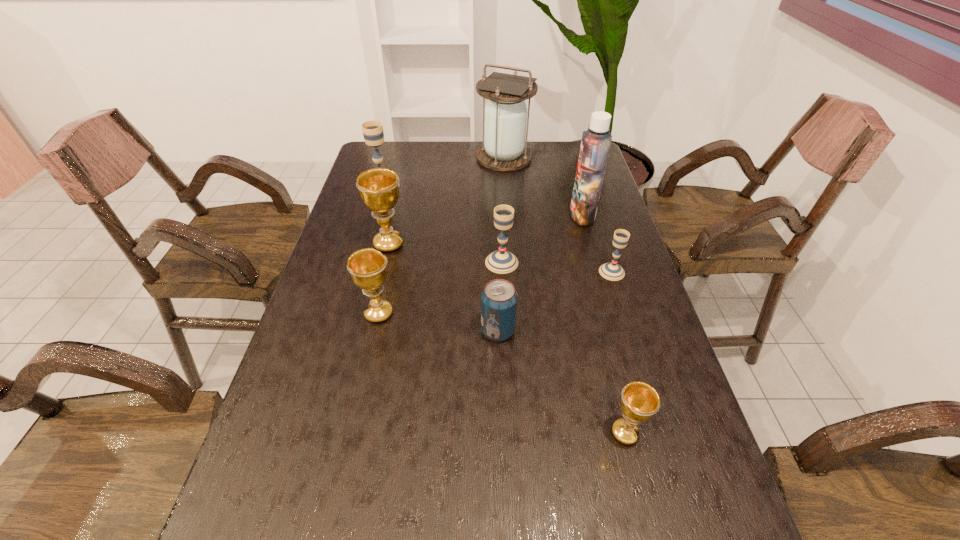
The height and width of the screenshot is (540, 960). I want to click on free point located 0.190m on the front of the biggest gray chalice, so click(370, 230).

Find the location of `vacant region located 0.210m on the left of the second gray chalice from right to left`. vacant region located 0.210m on the left of the second gray chalice from right to left is located at coordinates (412, 262).

Find the location of a particular element. vacant region located on the back of the second farthest gold chalice is located at coordinates (387, 276).

Where is `vacant space located 0.350m on the right of the pop soda`? The height and width of the screenshot is (540, 960). vacant space located 0.350m on the right of the pop soda is located at coordinates (659, 331).

The width and height of the screenshot is (960, 540). I want to click on free point located on the left of the smallest gray chalice, so click(570, 272).

At what (x,y) coordinates should I click in order to perform the action: click on vacant region located 0.390m on the back of the smallest gold chalice. Please return your answer as a coordinate pair (x, y). This screenshot has height=540, width=960. Looking at the image, I should click on (588, 285).

Find the location of a particular element. object that is at the far edge is located at coordinates (504, 133).

Identify the location of shampoo located at the right edge. (595, 145).

Where is `free space at the left edge`? The image size is (960, 540). free space at the left edge is located at coordinates (356, 354).

What are the coordinates of `vacant space at the right edge of the desktop` in the screenshot? It's located at (636, 287).